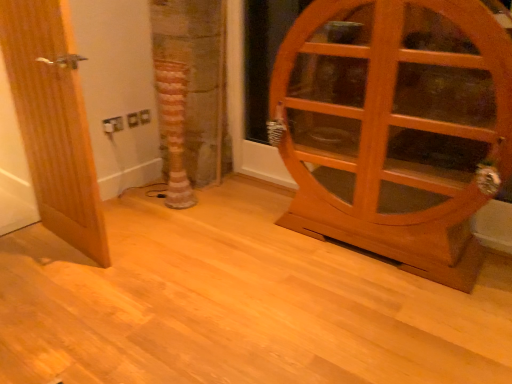
Find the location of a particular element. free space to the back side of wooden door at left, the 2th door from the right is located at coordinates (126, 210).